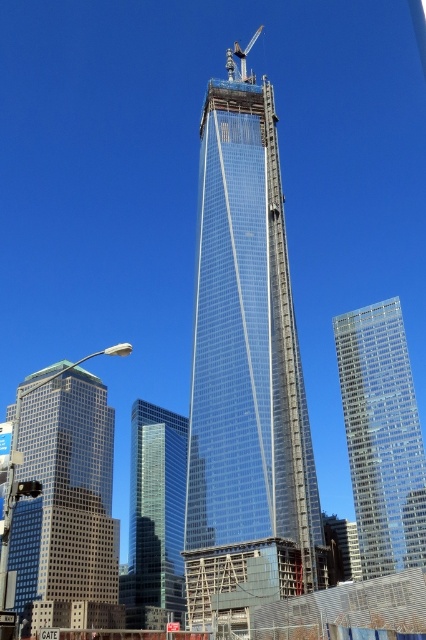
Question: Does transparent glass building at right have a smaller size compared to metallic gray crane at upper center?

Choices:
 (A) yes
 (B) no

Answer: (A)

Question: Which of the following is the closest to the observer?

Choices:
 (A) transparent glass tower at center
 (B) transparent glass building at right
 (C) metallic gray crane at upper center
 (D) clear glass skyscraper at center

Answer: (A)

Question: Does transparent glass building at right appear on the left side of clear glass skyscraper at center?

Choices:
 (A) no
 (B) yes

Answer: (A)

Question: Which point is closer to the camera?

Choices:
 (A) glassy reflective skyscraper at left
 (B) transparent glass tower at center
 (C) clear glass skyscraper at center

Answer: (B)

Question: Based on their relative distances, which object is nearer to the metallic gray crane at upper center?

Choices:
 (A) transparent glass tower at center
 (B) clear glass skyscraper at center

Answer: (A)

Question: Can you confirm if glassy reflective skyscraper at left is positioned to the left of clear glass skyscraper at center?

Choices:
 (A) yes
 (B) no

Answer: (A)